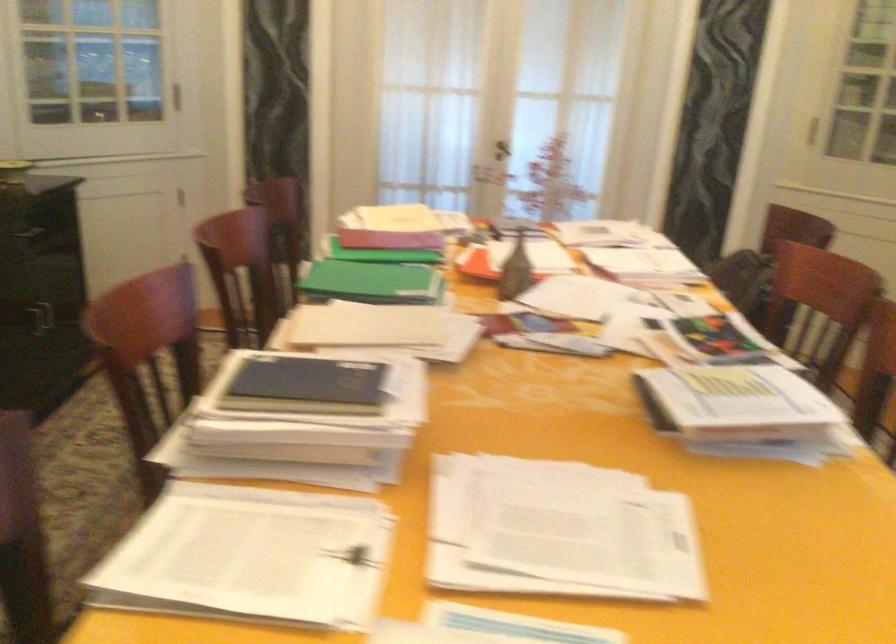
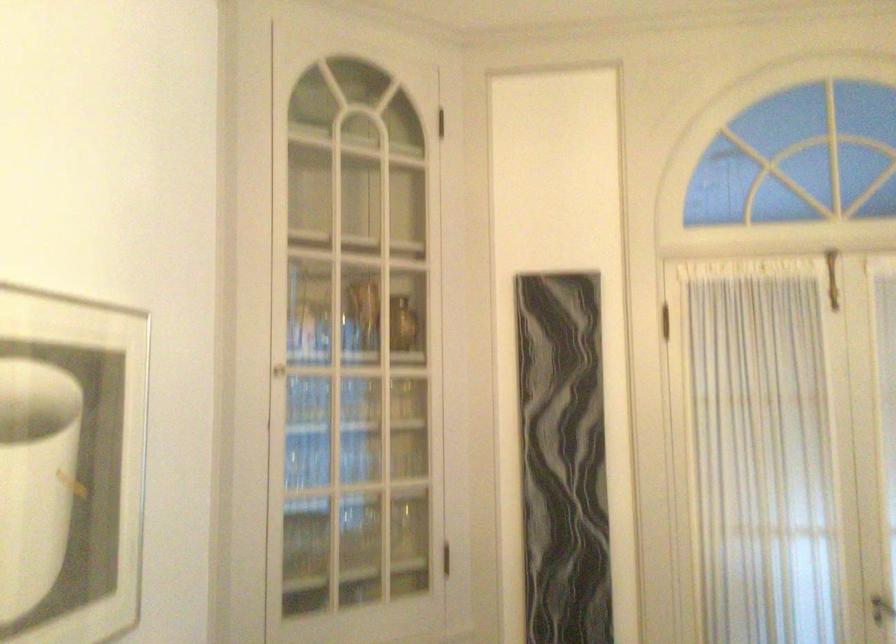
Find the pixel in the second image that matches [502,154] in the first image.

(882, 609)